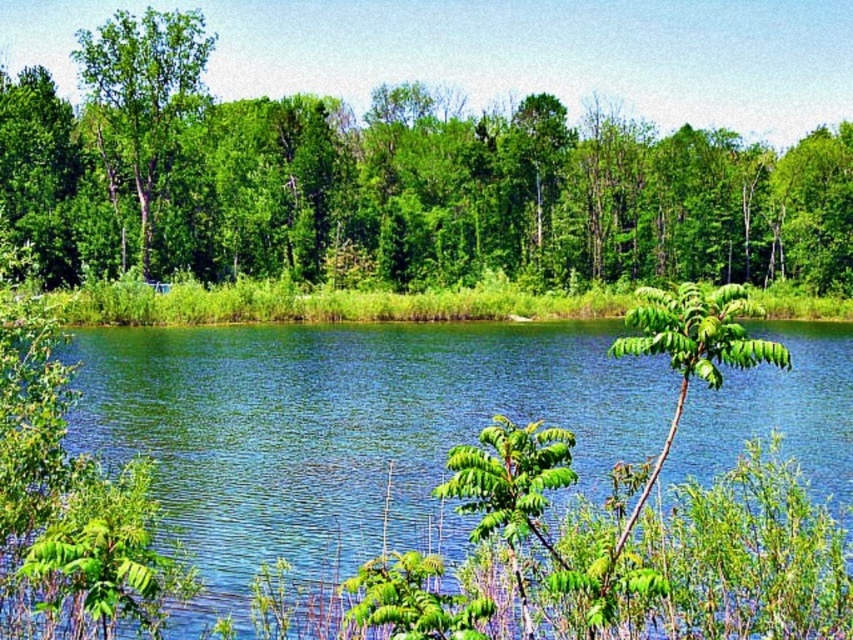
Question: Is green leafy tree at upper center further to camera compared to green leafy tree at upper left?

Choices:
 (A) no
 (B) yes

Answer: (A)

Question: Is blue water at center behind green leafy tree at upper left?

Choices:
 (A) yes
 (B) no

Answer: (B)

Question: Which is farther from the green leafy tree at upper left?

Choices:
 (A) blue water at center
 (B) green leafy tree at upper center

Answer: (A)

Question: Which object is positioned closest to the blue water at center?

Choices:
 (A) green leafy tree at upper left
 (B) green leafy tree at upper center

Answer: (A)

Question: Is green leafy tree at upper center to the left of green leafy tree at upper left from the viewer's perspective?

Choices:
 (A) yes
 (B) no

Answer: (B)

Question: Which of the following is the closest to the observer?

Choices:
 (A) blue water at center
 (B) green leafy tree at upper center

Answer: (A)